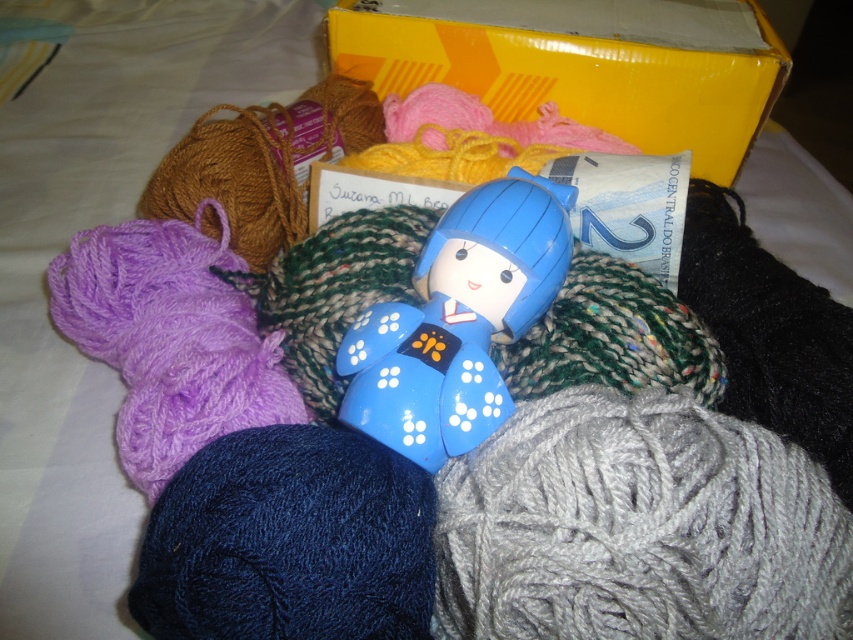
Can you confirm if yellow cardboard box at upper center is shorter than blue glossy doll at center?

No, yellow cardboard box at upper center is not shorter than blue glossy doll at center.

Which is in front, point (703, 115) or point (468, 358)?

Point (468, 358) is in front.

This screenshot has height=640, width=853. I want to click on yellow cardboard box at upper center, so click(x=577, y=77).